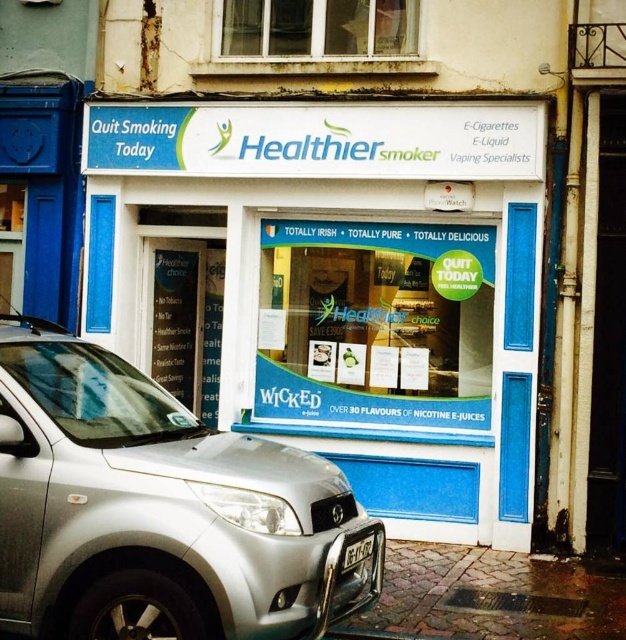
You are driving a car and see the white plastic storefront at center and the white plastic license plate at lower center through the windshield. Which object is located more to the left?

The white plastic storefront at center is positioned on the left side of the white plastic license plate at lower center, so it is more to the left.

You are a customer standing in front of the Healthier Smoker store. You see the white plastic storefront at center and the silver metallic car at lower left. Which object takes up more space in the image?

The white plastic storefront at center takes up more space in the image because it is bigger than the silver metallic car at lower left.

What are the coordinates of the white plastic storefront at center?

The white plastic storefront at center is located at coordinates point (349, 284).